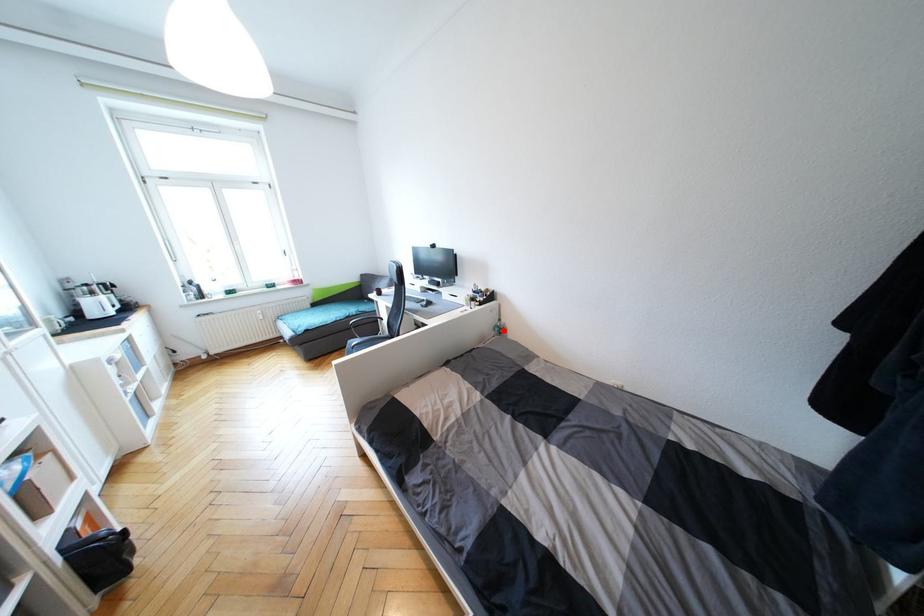
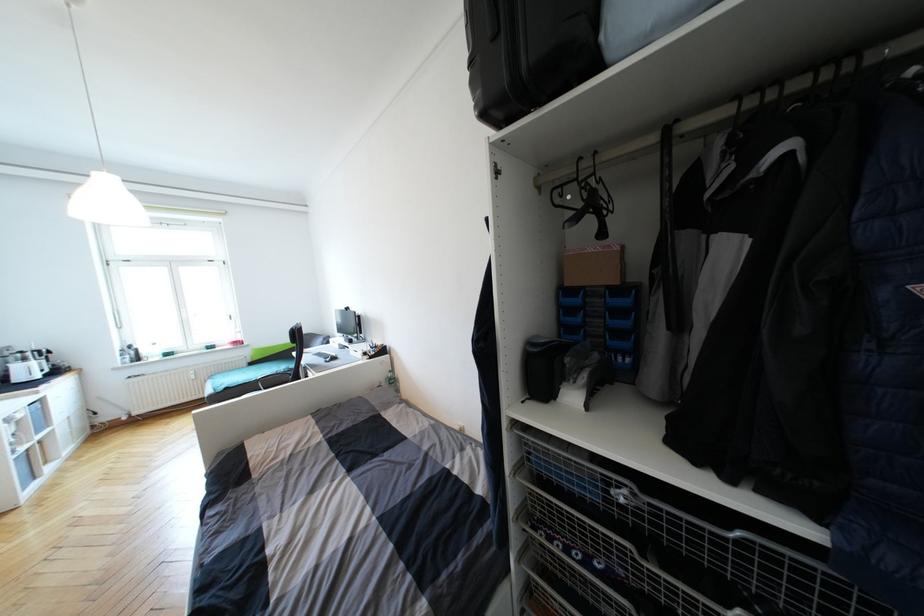
Question: I am providing you with two images of the same scene from different viewpoints. In image1, a red point is highlighted. Considering the same 3D point in image2, which of the following is correct?

Choices:
 (A) It is closer
 (B) It is farther

Answer: (B)